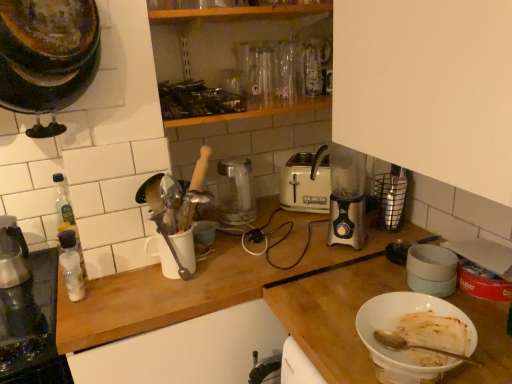
You are a GUI agent. You are given a task and a screenshot of the screen. Output one action in this format:
    pyautogui.click(x=<x>, y=<y>)
    Task: Click on the free spot in front of clear plastic bottle at left, the 1th bottle viewed from the front
    
    Given the screenshot: What is the action you would take?
    pyautogui.click(x=73, y=312)